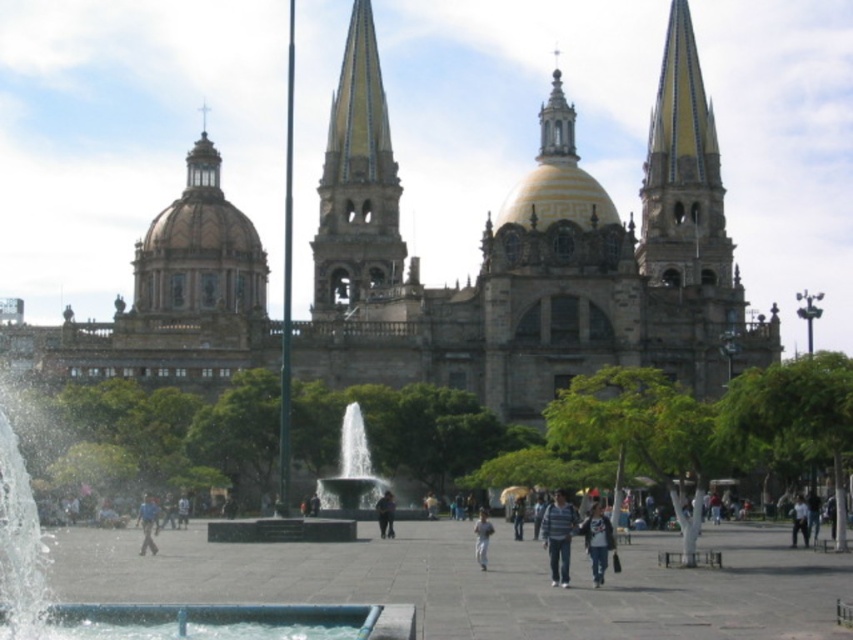
Who is lower down, striped shirt at center or light blue jeans at center?

Positioned lower is light blue jeans at center.

Which is more to the right, striped shirt at center or light blue jeans at center?

Positioned to the right is light blue jeans at center.

Between point (566, 586) and point (804, 500), which one is positioned in front?

Point (566, 586) is more forward.

Identify the location of striped shirt at center. Image resolution: width=853 pixels, height=640 pixels. (558, 536).

Between brown stone church at center and dark blue jeans at center, which one has less height?

Standing shorter between the two is dark blue jeans at center.

Who is more forward, (357, 368) or (386, 516)?

Point (386, 516)

Where is `brown stone church at center`? The height and width of the screenshot is (640, 853). brown stone church at center is located at coordinates (531, 257).

Can you confirm if blue denim jeans at center is smaller than blue fabric person at lower left?

Yes.

Is blue denim jeans at center shorter than blue fabric person at lower left?

Incorrect, blue denim jeans at center's height does not fall short of blue fabric person at lower left's.

At what (x,y) coordinates should I click in order to perform the action: click on blue denim jeans at center. Please return your answer as a coordinate pair (x, y). Looking at the image, I should click on (596, 541).

You are a GUI agent. You are given a task and a screenshot of the screen. Output one action in this format:
    pyautogui.click(x=<x>, y=<y>)
    Task: Click on the blue denim jeans at center
    Image resolution: width=853 pixels, height=640 pixels.
    Given the screenshot: What is the action you would take?
    pyautogui.click(x=596, y=541)